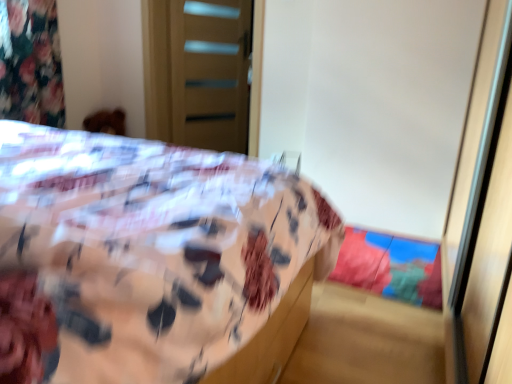
Question: Can transparent plastic screen door at right, arranged as the 2th screen door when viewed from the back, be found inside wooden door at upper center, the first screen door when ordered from left to right?

Choices:
 (A) no
 (B) yes

Answer: (A)

Question: From the image's perspective, would you say wooden door at upper center, the first screen door when ordered from left to right, is positioned over transparent plastic screen door at right, placed as the second screen door when sorted from left to right?

Choices:
 (A) yes
 (B) no

Answer: (A)

Question: From the image's perspective, is wooden door at upper center, the first screen door when ordered from left to right, located beneath transparent plastic screen door at right, placed as the second screen door when sorted from left to right?

Choices:
 (A) yes
 (B) no

Answer: (B)

Question: Is wooden door at upper center, the second screen door when ordered from front to back, turned away from transparent plastic screen door at right, placed as the second screen door when sorted from left to right?

Choices:
 (A) yes
 (B) no

Answer: (B)

Question: From a real-world perspective, is wooden door at upper center, the first screen door when ordered from left to right, physically above transparent plastic screen door at right, the 1th screen door viewed from the front?

Choices:
 (A) no
 (B) yes

Answer: (B)

Question: Does wooden door at upper center, the second screen door when ordered from front to back, have a greater width compared to transparent plastic screen door at right, marked as the 1th screen door in a right-to-left arrangement?

Choices:
 (A) yes
 (B) no

Answer: (A)

Question: Does wooden door at upper center, the first screen door when ordered from left to right, lie behind floral fabric bed at center?

Choices:
 (A) yes
 (B) no

Answer: (A)

Question: Is wooden door at upper center, placed as the first screen door when sorted from back to front, with floral fabric bed at center?

Choices:
 (A) no
 (B) yes

Answer: (A)

Question: Is wooden door at upper center, the first screen door when ordered from left to right, smaller than floral fabric bed at center?

Choices:
 (A) no
 (B) yes

Answer: (B)

Question: From a real-world perspective, is wooden door at upper center, the second screen door when ordered from front to back, positioned under floral fabric bed at center based on gravity?

Choices:
 (A) no
 (B) yes

Answer: (A)

Question: Considering the relative positions of wooden door at upper center, the second screen door when ordered from front to back, and floral fabric bed at center in the image provided, is wooden door at upper center, the second screen door when ordered from front to back, to the right of floral fabric bed at center from the viewer's perspective?

Choices:
 (A) no
 (B) yes

Answer: (B)

Question: From the image's perspective, would you say wooden door at upper center, the first screen door when ordered from left to right, is positioned over floral fabric bed at center?

Choices:
 (A) no
 (B) yes

Answer: (B)

Question: Is floral fabric bed at center in contact with wooden door at upper center, the first screen door when ordered from left to right?

Choices:
 (A) yes
 (B) no

Answer: (B)